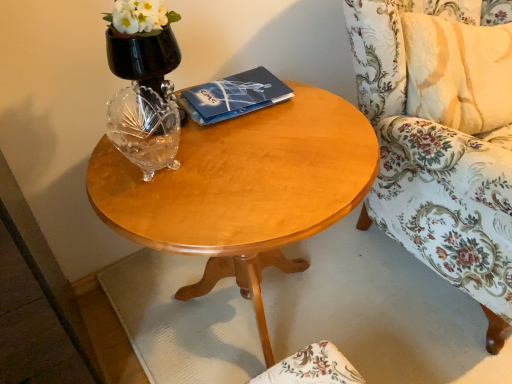
Question: From the image's perspective, is dark blue matte paper at center located above or below black glass vase at upper left?

Choices:
 (A) below
 (B) above

Answer: (A)

Question: Considering the positions of point (207, 117) and point (126, 49), is point (207, 117) closer or farther from the camera than point (126, 49)?

Choices:
 (A) closer
 (B) farther

Answer: (B)

Question: Which object is the farthest from the dark blue matte paper at center?

Choices:
 (A) black glass vase at upper left
 (B) light wood/finish coffee table at center
 (C) floral fabric chair at right

Answer: (C)

Question: Based on their relative distances, which object is nearer to the floral fabric chair at right?

Choices:
 (A) black glass vase at upper left
 (B) light wood/finish coffee table at center
 (C) dark blue matte paper at center

Answer: (B)